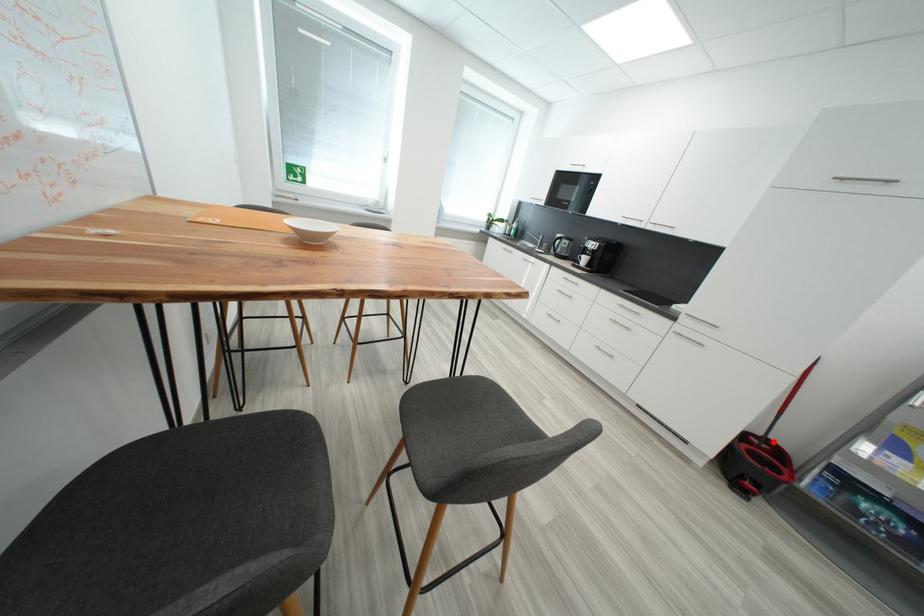
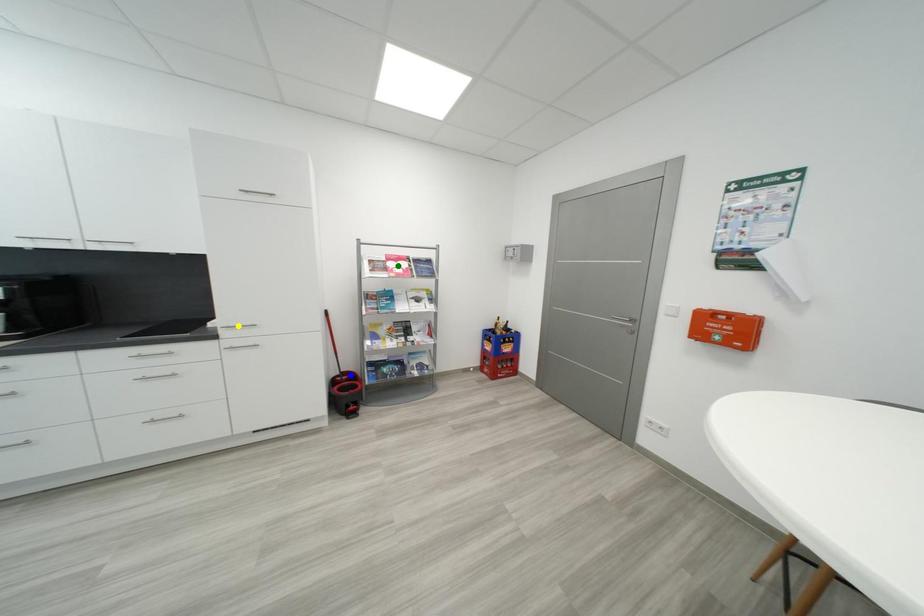
Question: I am providing you with two images of the same scene from different viewpoints. A red point is marked on the first image. You are given multiple points on the second image. Which mark in image 2 goes with the point in image 1?

Choices:
 (A) yellow point
 (B) green point
 (C) blue point

Answer: (C)